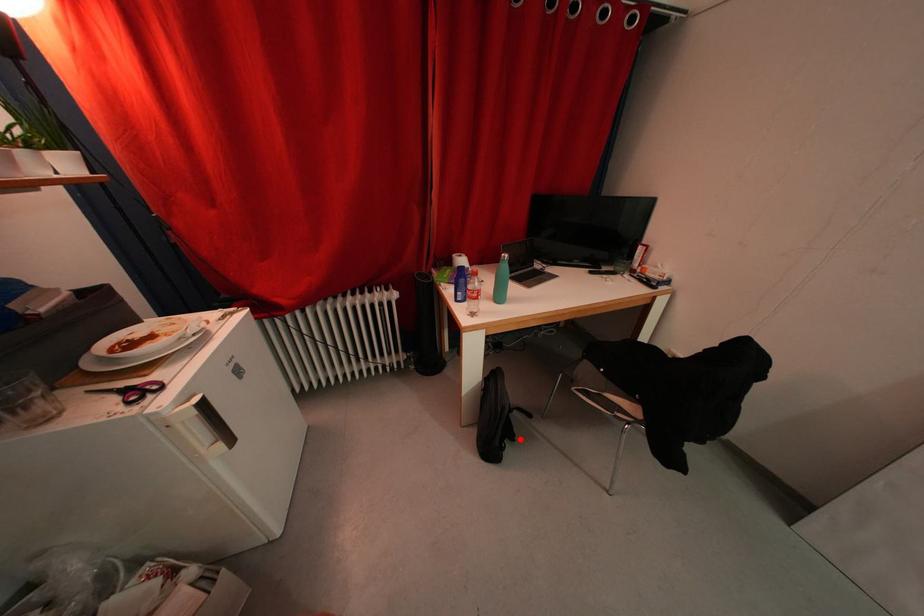
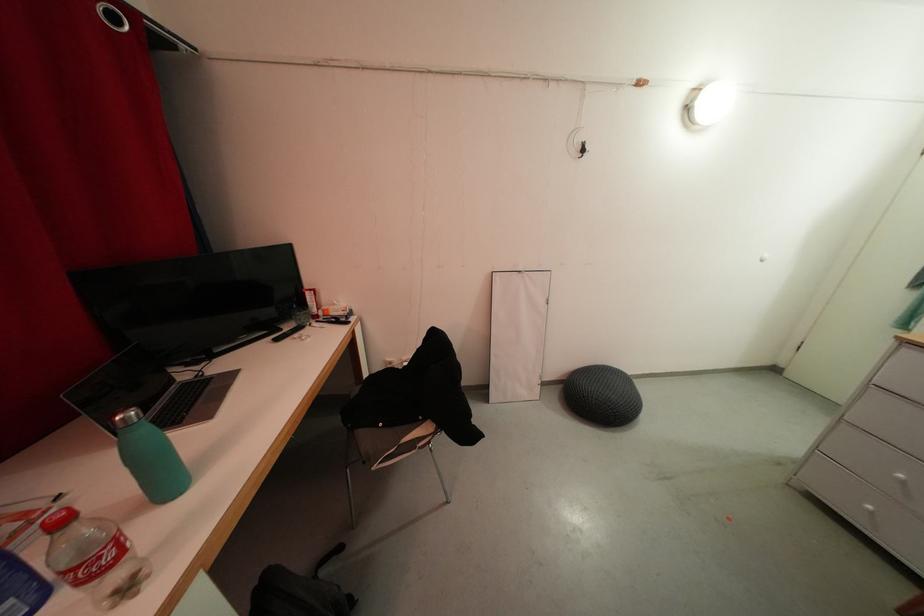
In the second image, find the point that corresponds to the highlighted location in the first image.

(357, 601)